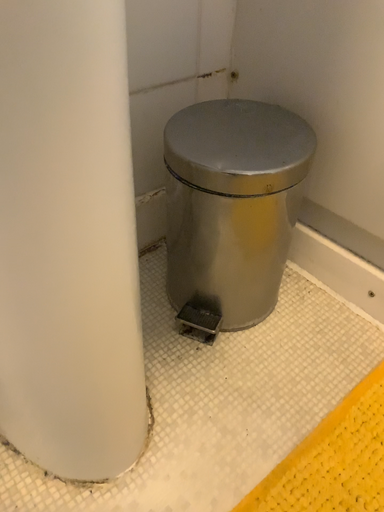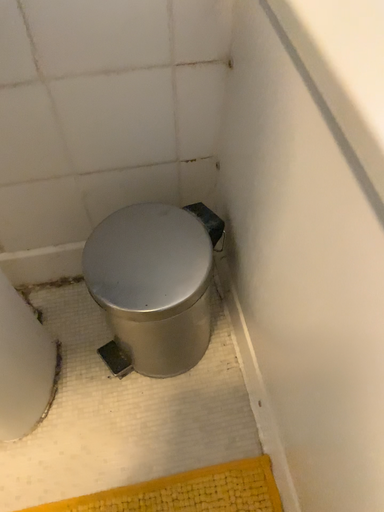
Question: Which way did the camera rotate in the video?

Choices:
 (A) rotated downward
 (B) rotated upward

Answer: (A)